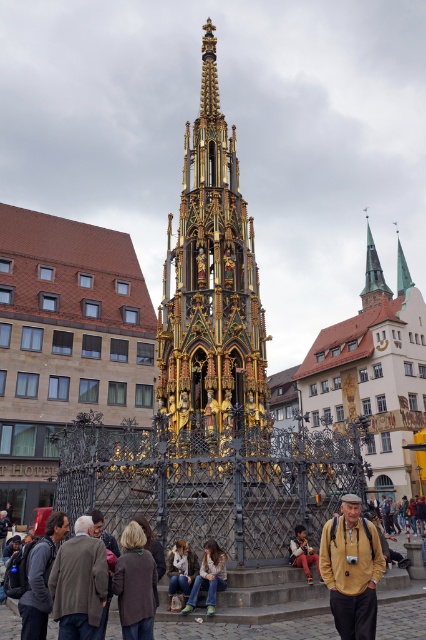
You are a tourist visiting the medieval fountain and want to take a photo that includes both the leather jacket at lower right and the green copper spire at upper right. Which object should you focus on first to ensure both are in the frame?

You should focus on the green copper spire at upper right first because it is larger than the leather jacket at lower right, so it will be easier to frame both objects by starting with the larger one.

From the picture: You are standing in the town square and see the leather jacket at lower right and the green copper spire at upper right. Which object is nearer to you?

The leather jacket at lower right is closer to the viewer than the green copper spire at upper right.